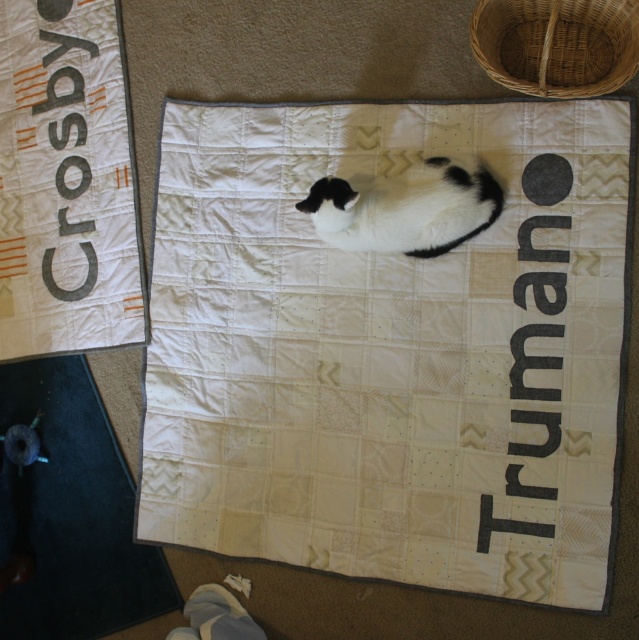
Question: Among these points, which one is farthest from the camera?

Choices:
 (A) (442, 193)
 (B) (435, 406)
 (C) (12, 316)

Answer: (C)

Question: Can you confirm if dark gray rubber mat at lower left is positioned to the left of black and white fur cat at center?

Choices:
 (A) yes
 (B) no

Answer: (A)

Question: Can you confirm if white quilt at center is smaller than black and white fur cat at center?

Choices:
 (A) no
 (B) yes

Answer: (A)

Question: Can you confirm if white quilt at center is bigger than black and white fur cat at center?

Choices:
 (A) no
 (B) yes

Answer: (B)

Question: Considering the real-world distances, which object is farthest from the white quilt at upper left?

Choices:
 (A) black and white fur cat at center
 (B) dark gray rubber mat at lower left
 (C) white quilt at center

Answer: (A)

Question: Estimate the real-world distances between objects in this image. Which object is closer to the black and white fur cat at center?

Choices:
 (A) dark gray rubber mat at lower left
 (B) white quilt at upper left

Answer: (B)